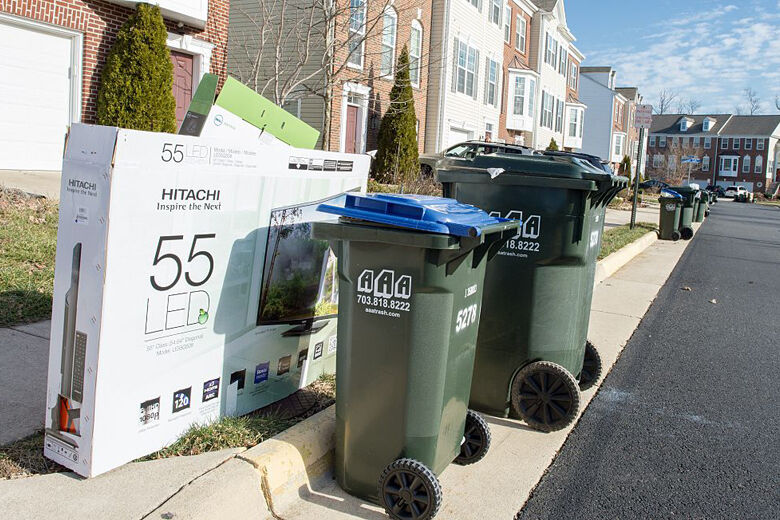
Where is `trash cans`? trash cans is located at coordinates (703, 209), (695, 211), (685, 220), (667, 220), (547, 299), (410, 349).